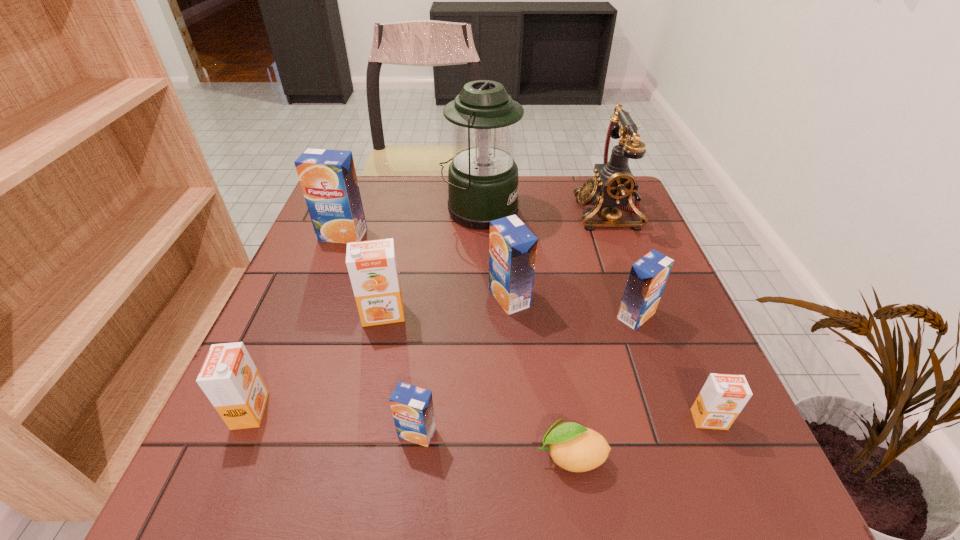
In the image, there is a desktop. Identify the location of vacant space at the near right corner. The height and width of the screenshot is (540, 960). (669, 477).

The image size is (960, 540). What are the coordinates of `vacant area that lies between the lantern and the second smallest blue orange_juice` in the screenshot? It's located at (558, 263).

Where is `empty space between the shortest object and the smallest blue orange_juice`? empty space between the shortest object and the smallest blue orange_juice is located at coordinates (494, 444).

Locate an element on the screen. free point between the second smallest blue orange_juice and the smallest orange orange juice is located at coordinates (672, 368).

Find the location of a particular element. This screenshot has height=540, width=960. blank region between the tallest orange juice and the third orange juice from right to left is located at coordinates point(426,266).

You are a GUI agent. You are given a task and a screenshot of the screen. Output one action in this format:
    pyautogui.click(x=<x>, y=<y>)
    Task: Click on the vacant area between the green lantern and the nearest blue orange_juice
    The width and height of the screenshot is (960, 540).
    Given the screenshot: What is the action you would take?
    pyautogui.click(x=448, y=322)

Find the location of a particular element. This screenshot has width=960, height=540. unoccupied position between the second biggest orange orange juice and the second orange orange juice from left to right is located at coordinates (317, 362).

Where is `vacant space that is in between the third tallest object and the third blue orange_juice from right to left`? The width and height of the screenshot is (960, 540). vacant space that is in between the third tallest object and the third blue orange_juice from right to left is located at coordinates (380, 334).

Locate an element on the screen. free space between the smallest blue orange_juice and the third blue orange_juice from left to right is located at coordinates (464, 366).

Identify which object is the seventh closest to the eighth shortest object. Please provide its 2D coordinates. Your answer should be formatted as a tuple, i.e. [(x, y)], where the tuple contains the x and y coordinates of a point satisfying the conditions above.

[(648, 276)]